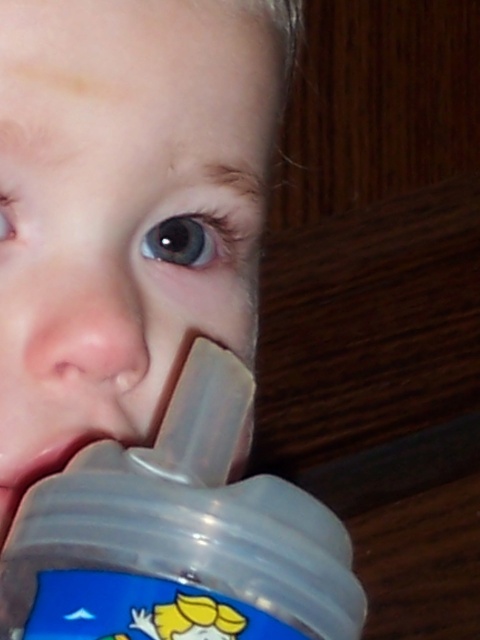
Which is in front, point (52, 348) or point (103, 460)?

Point (103, 460)

Is matte plastic nose at center taller than transparent plastic mouth at lower left?

Yes.

The image size is (480, 640). I want to click on matte plastic nose at center, so click(x=85, y=328).

I want to click on matte plastic nose at center, so click(85, 328).

What are the coordinates of `translucent plastic sippy cup at lower left` in the screenshot? It's located at (126, 209).

Does point (165, 244) come farther from viewer compared to point (99, 317)?

Yes, point (165, 244) is behind point (99, 317).

The height and width of the screenshot is (640, 480). Identify the location of translucent plastic sippy cup at lower left. (126, 209).

Who is shorter, translucent plastic sippy cup at lower left or transparent plastic baby bottle at lower center?

Standing shorter between the two is transparent plastic baby bottle at lower center.

This screenshot has width=480, height=640. I want to click on translucent plastic sippy cup at lower left, so click(126, 209).